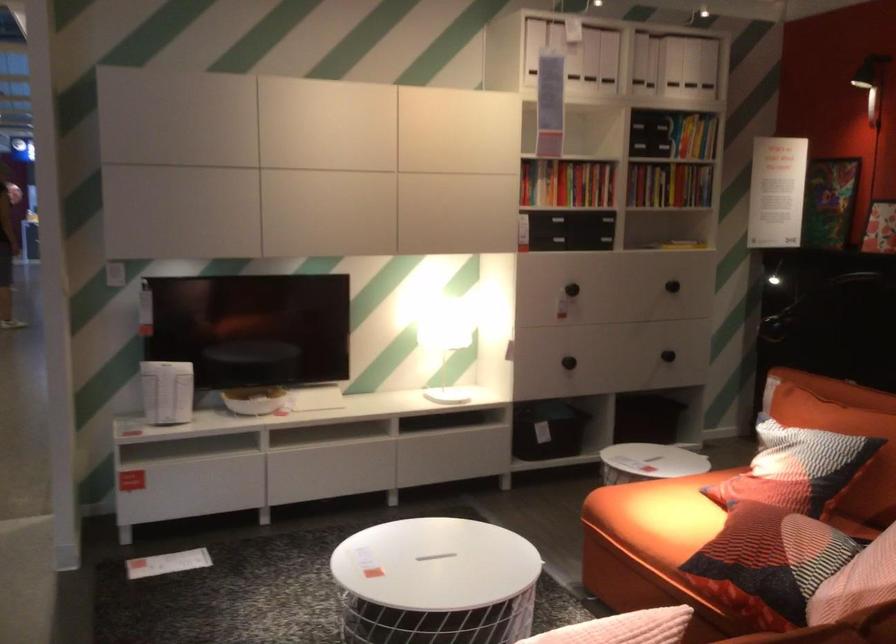
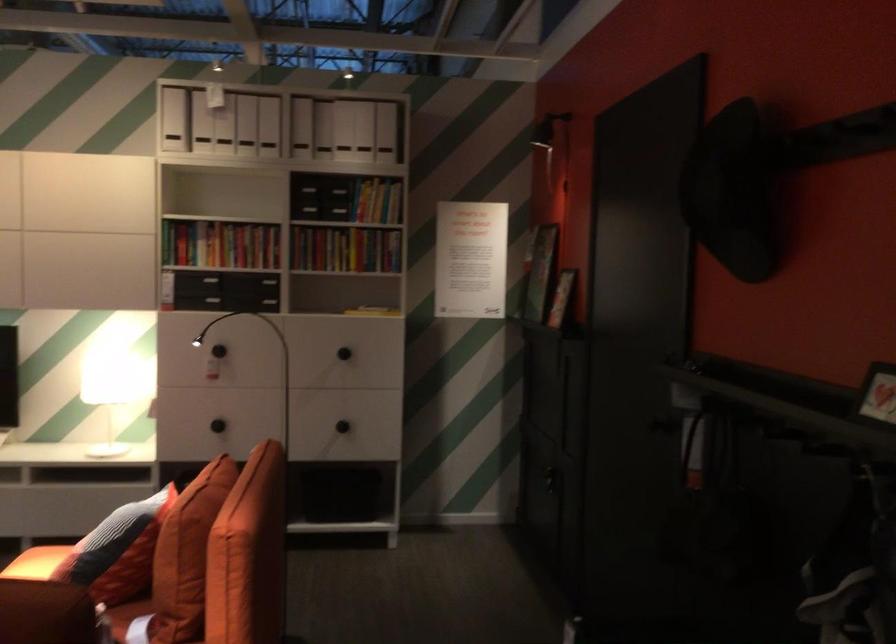
Find the pixel in the second image that matches (709,336) in the first image.

(341, 426)